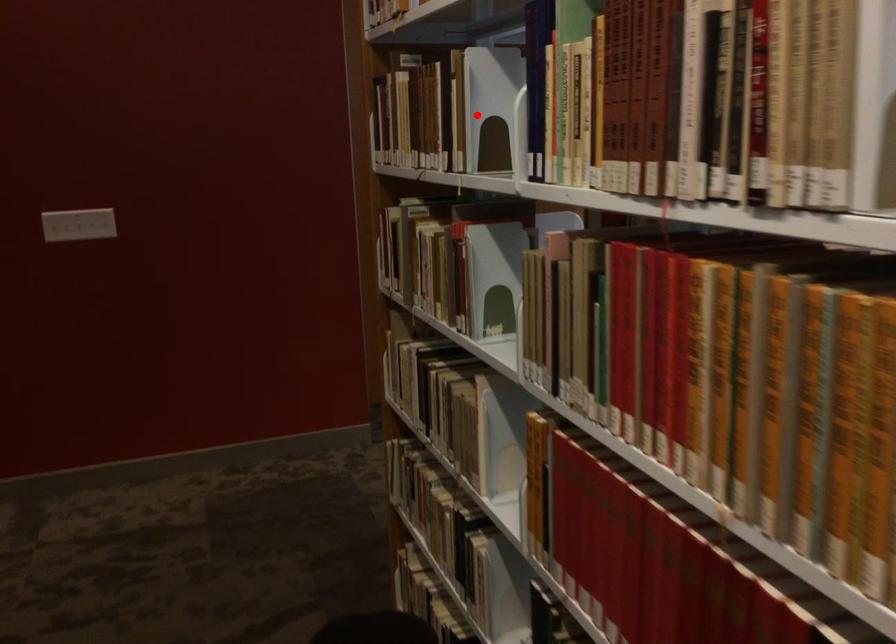
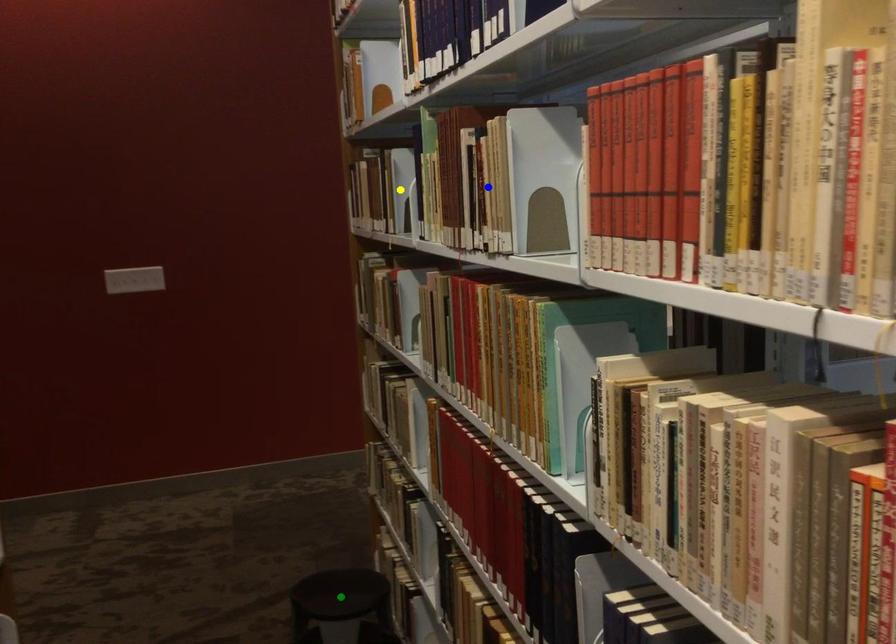
Question: I am providing you with two images of the same scene from different viewpoints. A red point is marked on the first image. You are given multiple points on the second image. Can you choose the point in image 2 that corresponds to the point in image 1?

Choices:
 (A) blue point
 (B) green point
 (C) yellow point

Answer: (C)